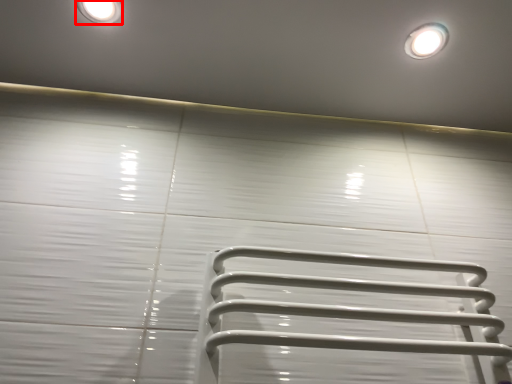
Question: Considering the relative positions of lighting (annotated by the red box) and droplight in the image provided, where is lighting (annotated by the red box) located with respect to the staircase?

Choices:
 (A) right
 (B) left

Answer: (B)